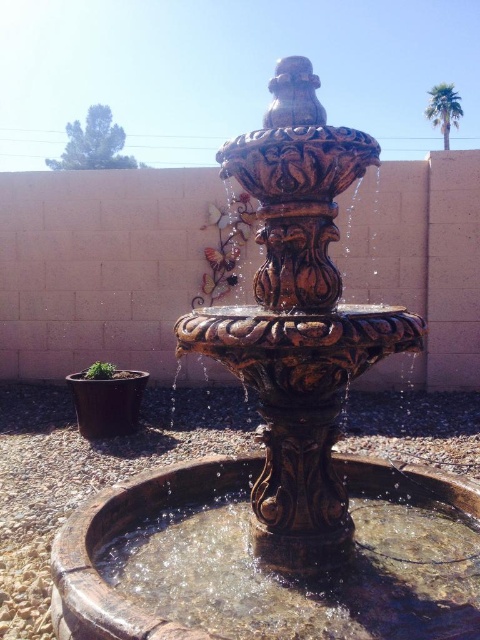
Which is above, clear glass water at center or green leafy palm at upper right?

green leafy palm at upper right

Does clear glass water at center have a greater width compared to green leafy palm at upper right?

Yes.

Identify the location of clear glass water at center. The height and width of the screenshot is (640, 480). (303, 577).

This screenshot has height=640, width=480. I want to click on clear glass water at center, so click(303, 577).